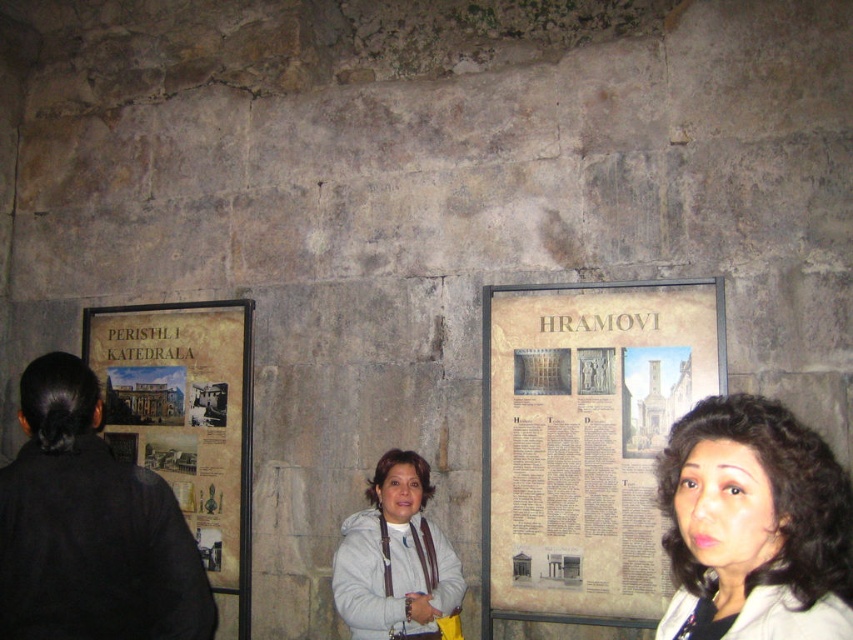
Can you confirm if black fabric at left is positioned above dark brown hair at center?

Actually, black fabric at left is below dark brown hair at center.

Where is `black fabric at left`? black fabric at left is located at coordinates [90, 528].

Is point (48, 428) positioned after point (740, 588)?

Yes, point (48, 428) is behind point (740, 588).

At what (x,y) coordinates should I click in order to perform the action: click on black fabric at left. Please return your answer as a coordinate pair (x, y). Looking at the image, I should click on (90, 528).

Which is more to the left, beige paper poster at center right or dark brown hair at center?

From the viewer's perspective, beige paper poster at center right appears more on the left side.

Which is more to the right, beige paper poster at center right or dark brown hair at center?

dark brown hair at center

Where is `beige paper poster at center right`? beige paper poster at center right is located at coordinates (585, 440).

The image size is (853, 640). Find the location of `beige paper poster at center right`. beige paper poster at center right is located at coordinates (585, 440).

Describe the element at coordinates (585, 440) in the screenshot. I see `beige paper poster at center right` at that location.

Locate an element on the screen. The image size is (853, 640). beige paper poster at center right is located at coordinates (585, 440).